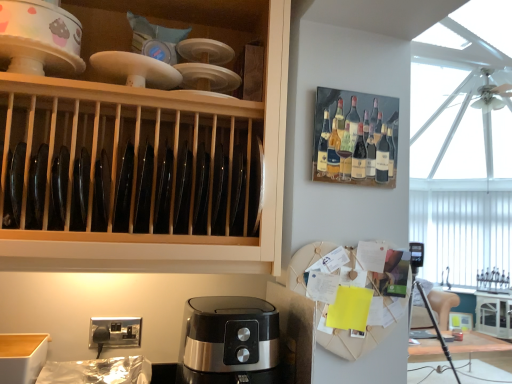
Question: Is matte ceramic bowl at upper left not near wooden plate rack at upper right?

Choices:
 (A) yes
 (B) no

Answer: (B)

Question: Does matte ceramic bowl at upper left turn towards wooden plate rack at upper right?

Choices:
 (A) yes
 (B) no

Answer: (B)

Question: Does matte ceramic bowl at upper left touch wooden plate rack at upper right?

Choices:
 (A) no
 (B) yes

Answer: (A)

Question: From a real-world perspective, is matte ceramic bowl at upper left physically below wooden plate rack at upper right?

Choices:
 (A) no
 (B) yes

Answer: (A)

Question: From a real-world perspective, is matte ceramic bowl at upper left on wooden plate rack at upper right?

Choices:
 (A) no
 (B) yes

Answer: (B)

Question: Does matte ceramic bowl at upper left have a greater height compared to wooden plate rack at upper right?

Choices:
 (A) yes
 (B) no

Answer: (B)

Question: Is wooden plate rack at upper right taller than satin black coffee maker at lower center?

Choices:
 (A) no
 (B) yes

Answer: (B)

Question: Could you tell me if wooden plate rack at upper right is facing satin black coffee maker at lower center?

Choices:
 (A) yes
 (B) no

Answer: (B)

Question: Is wooden plate rack at upper right completely or partially outside of satin black coffee maker at lower center?

Choices:
 (A) yes
 (B) no

Answer: (A)

Question: Is wooden plate rack at upper right surrounding satin black coffee maker at lower center?

Choices:
 (A) yes
 (B) no

Answer: (B)

Question: Is wooden plate rack at upper right at the right side of satin black coffee maker at lower center?

Choices:
 (A) no
 (B) yes

Answer: (B)

Question: Is satin black coffee maker at lower center at the back of wooden plate rack at upper right?

Choices:
 (A) no
 (B) yes

Answer: (A)

Question: Is white glossy cabinet at right, acting as the second cabinetry starting from the top, looking in the opposite direction of wooden plate rack at upper right?

Choices:
 (A) no
 (B) yes

Answer: (A)